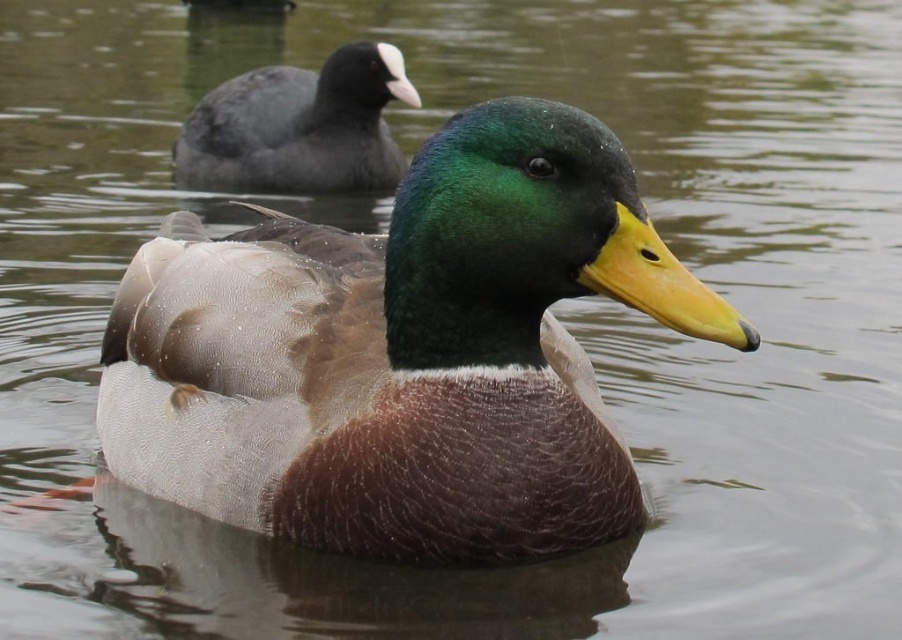
Question: Can you confirm if green glossy duck at center is thinner than matte gray duck at upper left?

Choices:
 (A) yes
 (B) no

Answer: (B)

Question: Does green glossy duck at center come in front of matte gray duck at upper left?

Choices:
 (A) yes
 (B) no

Answer: (A)

Question: Can you confirm if green glossy duck at center is positioned to the left of matte gray duck at upper left?

Choices:
 (A) yes
 (B) no

Answer: (B)

Question: Which point is closer to the camera?

Choices:
 (A) tap(371, 372)
 (B) tap(413, 88)

Answer: (A)

Question: Which point appears closest to the camera in this image?

Choices:
 (A) (315, 147)
 (B) (614, 180)

Answer: (B)